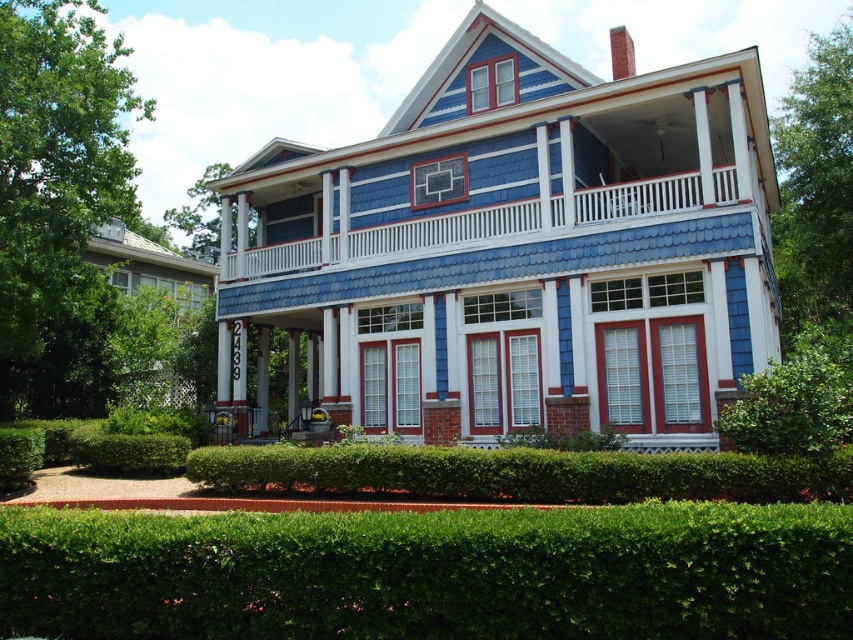
You are standing in the front yard of the house looking towards the entrance. You notice the blue shingles at upper center and the green leafy bush at lower right. Which object is higher up in the scene?

The blue shingles at upper center are higher up in the scene than the green leafy bush at lower right.